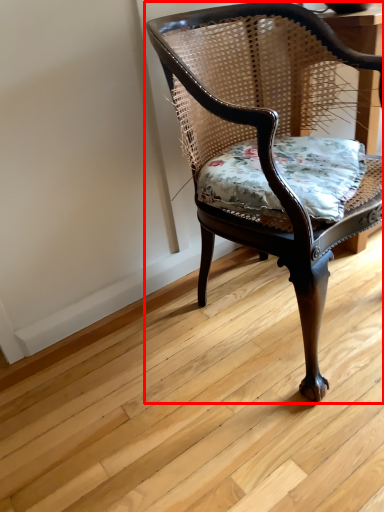
Question: In this image, where is chair (annotated by the red box) located relative to pillow?

Choices:
 (A) left
 (B) right

Answer: (A)